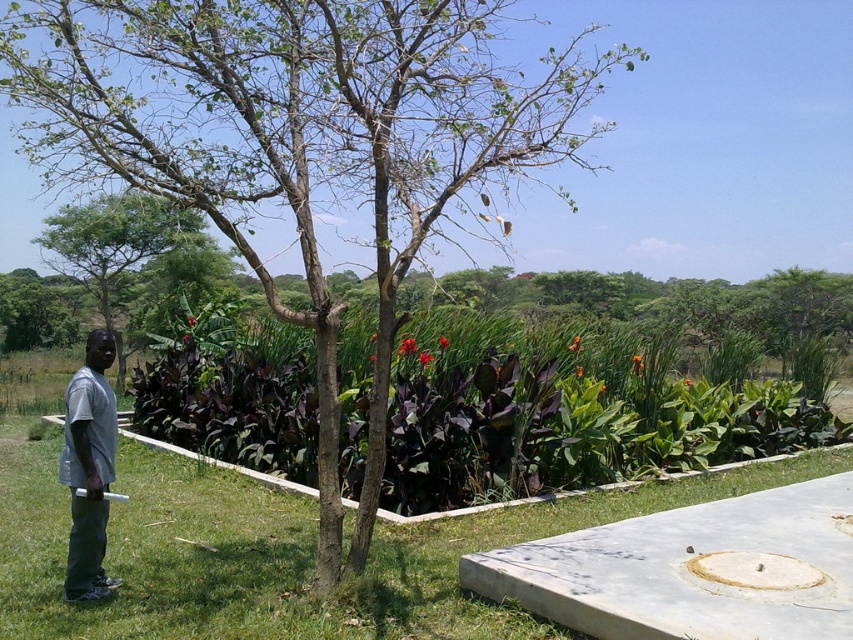
Does green leafy tree at center have a lesser height compared to green matte tree at left?

No.

Who is higher up, green leafy tree at center or green matte tree at left?

green leafy tree at center is above.

Who is more distant from viewer, (322, 364) or (41, 237)?

The point (41, 237) is behind.

Where is `green leafy tree at center`? Image resolution: width=853 pixels, height=640 pixels. green leafy tree at center is located at coordinates (299, 141).

Which of these two, green matte tree at left or gray matte shirt at left, stands shorter?

Standing shorter between the two is gray matte shirt at left.

Consider the image. Is green matte tree at left taller than gray matte shirt at left?

Yes.

Find the location of a particular element. green matte tree at left is located at coordinates (114, 244).

Where is `green matte tree at left`? This screenshot has height=640, width=853. green matte tree at left is located at coordinates (114, 244).

Which is in front, point (325, 60) or point (100, 422)?

Positioned in front is point (325, 60).

Does green leafy tree at center have a smaller size compared to gray matte shirt at left?

No.

At what (x,y) coordinates should I click in order to perform the action: click on green leafy tree at center. Please return your answer as a coordinate pair (x, y). The width and height of the screenshot is (853, 640). Looking at the image, I should click on point(299,141).

Where is `green leafy tree at center`? The image size is (853, 640). green leafy tree at center is located at coordinates 299,141.